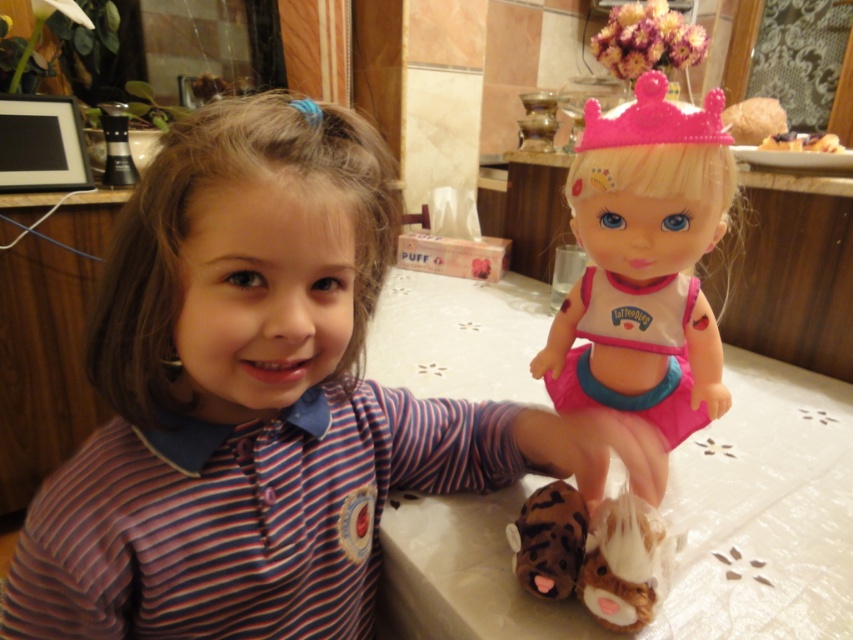
Where is `white lace tablecloth at center`? Image resolution: width=853 pixels, height=640 pixels. white lace tablecloth at center is located at coordinates (763, 509).

Who is lower down, white lace tablecloth at center or pink plastic doll at center?

white lace tablecloth at center

Where is `white lace tablecloth at center`? Image resolution: width=853 pixels, height=640 pixels. white lace tablecloth at center is located at coordinates (763, 509).

Between point (280, 259) and point (448, 316), which one is positioned in front?

Point (280, 259) is more forward.

Who is higher up, striped fabric child at center or white lace tablecloth at center?

striped fabric child at center

Which is behind, point (294, 188) or point (822, 534)?

The point (822, 534) is more distant.

At what (x,y) coordinates should I click in order to perform the action: click on striped fabric child at center. Please return your answer as a coordinate pair (x, y). This screenshot has height=640, width=853. Looking at the image, I should click on (250, 397).

Between point (257, 380) and point (587, 515), which one is positioned in front?

Point (257, 380)

Does point (120, 404) come closer to viewer compared to point (529, 513)?

Yes, it is.

The width and height of the screenshot is (853, 640). I want to click on striped fabric child at center, so click(x=250, y=397).